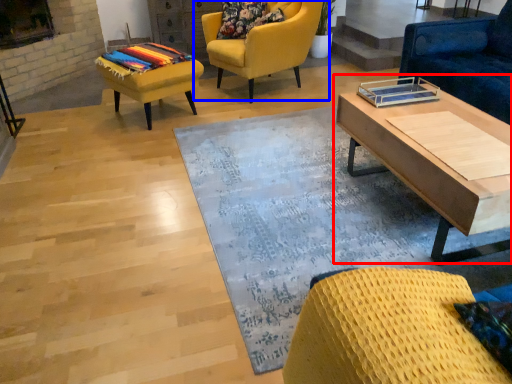
Question: Which of the following is the closest to the observer, coffee table (highlighted by a red box) or chair (highlighted by a blue box)?

Choices:
 (A) coffee table
 (B) chair

Answer: (A)